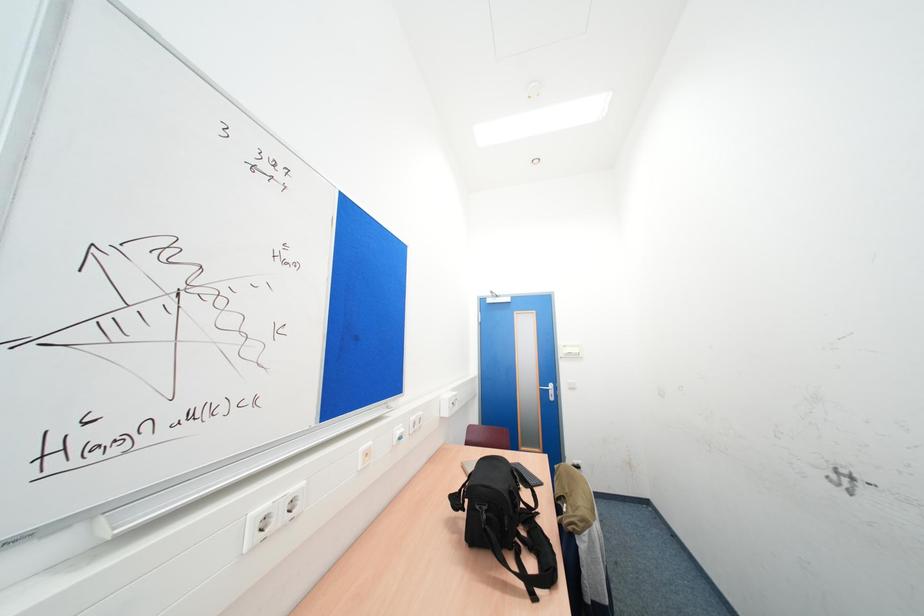
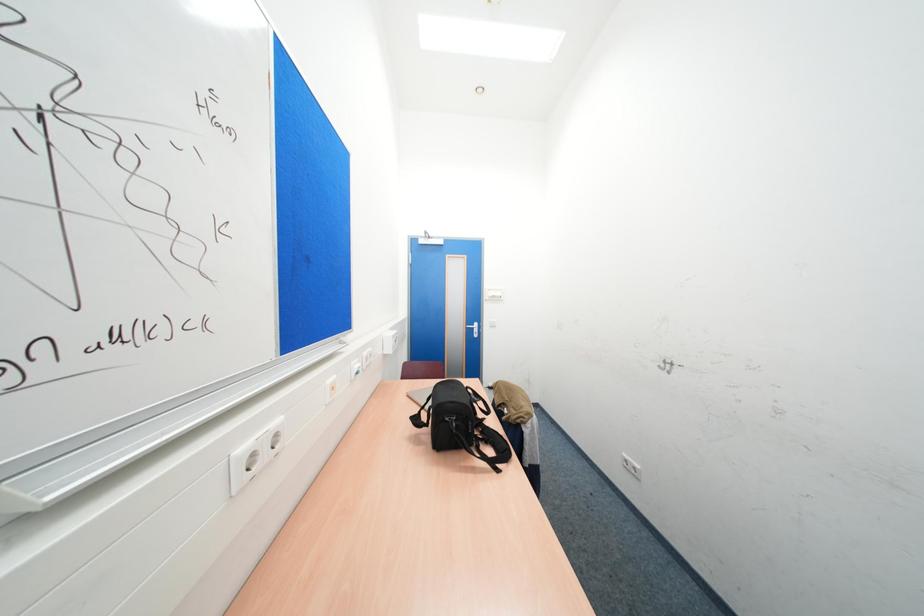
Question: What movement of the cameraman would produce the second image?

Choices:
 (A) Left
 (B) Right
 (C) Forward
 (D) Backward

Answer: (A)